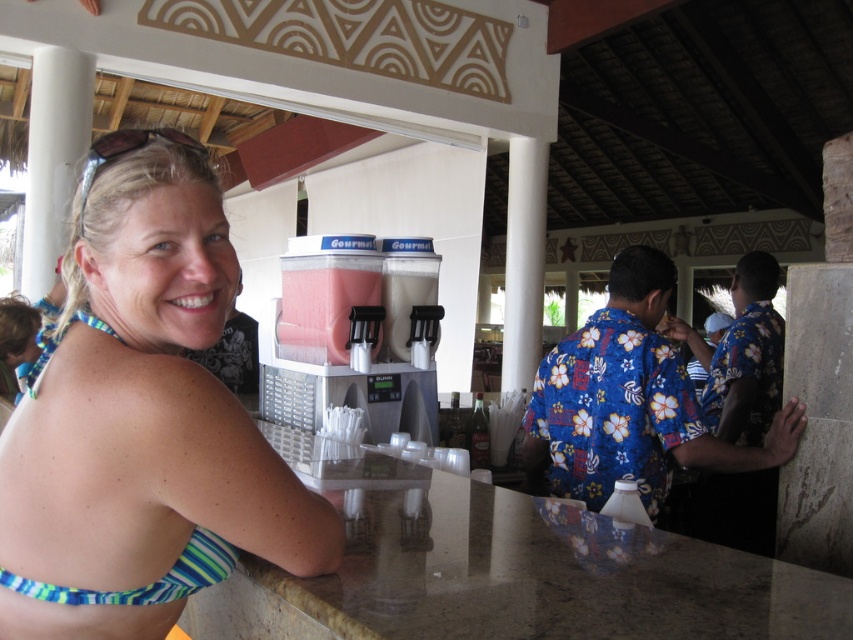
Question: Which point appears closest to the camera in this image?

Choices:
 (A) (131, 156)
 (B) (193, 540)

Answer: (A)

Question: Estimate the real-world distances between objects in this image. Which object is closer to the striped fabric bikini top at left?

Choices:
 (A) translucent plastic cup at center
 (B) blue floral shirt at center

Answer: (B)

Question: Which point is farther to the camera?

Choices:
 (A) (480, 428)
 (B) (608, 419)
 (C) (193, 396)
 (D) (48, 326)

Answer: (A)

Question: Is blue floral shirt at center to the left of striped fabric bikini top at left from the viewer's perspective?

Choices:
 (A) yes
 (B) no

Answer: (B)

Question: From the image, what is the correct spatial relationship of blue striped bikini top at left in relation to blue floral shirt at center?

Choices:
 (A) below
 (B) above

Answer: (B)

Question: Is blue floral shirt at center above striped fabric bikini top at left?

Choices:
 (A) no
 (B) yes

Answer: (B)